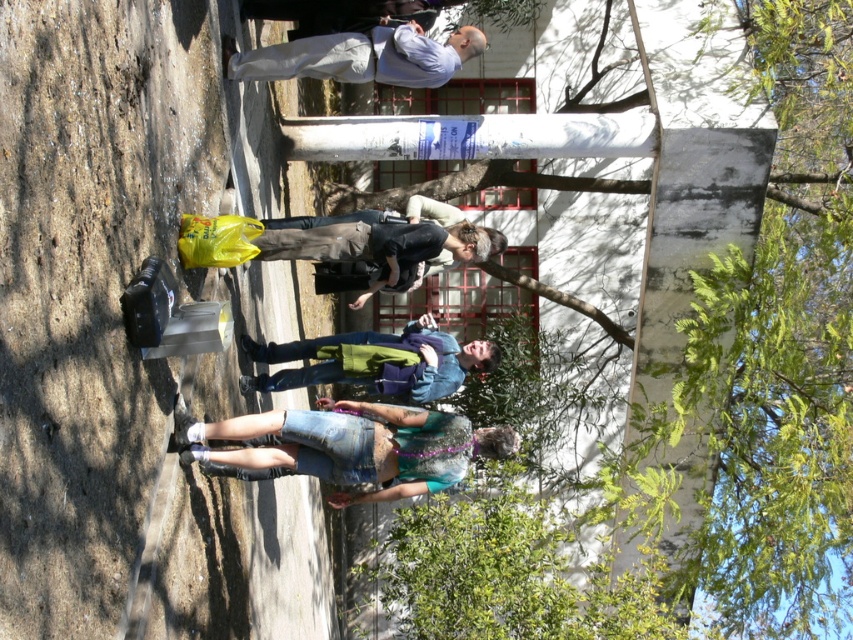
You are standing at the point marked as point (357, 445) in the image. What clothing item is located exactly at this point?

Denim shorts at lower center is located exactly at point (357, 445).